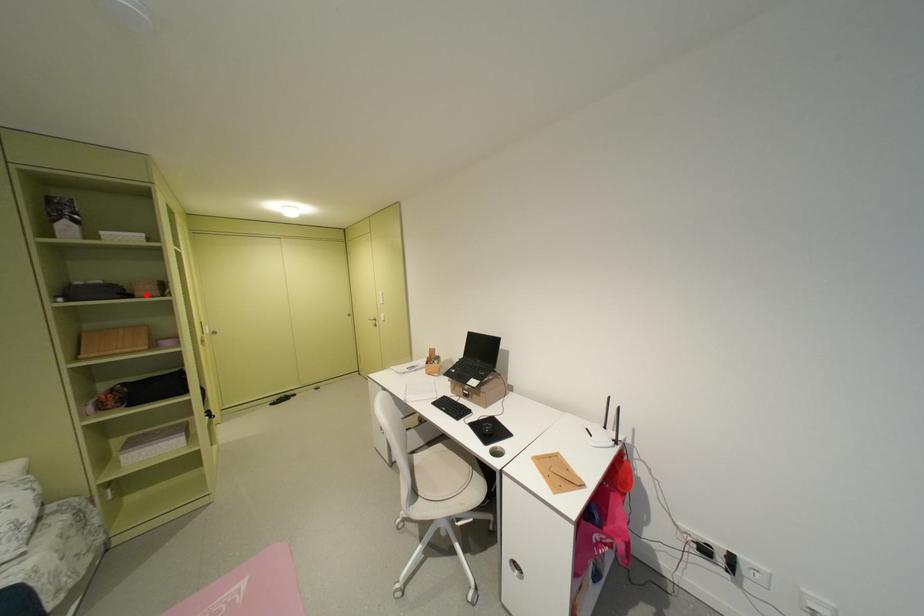
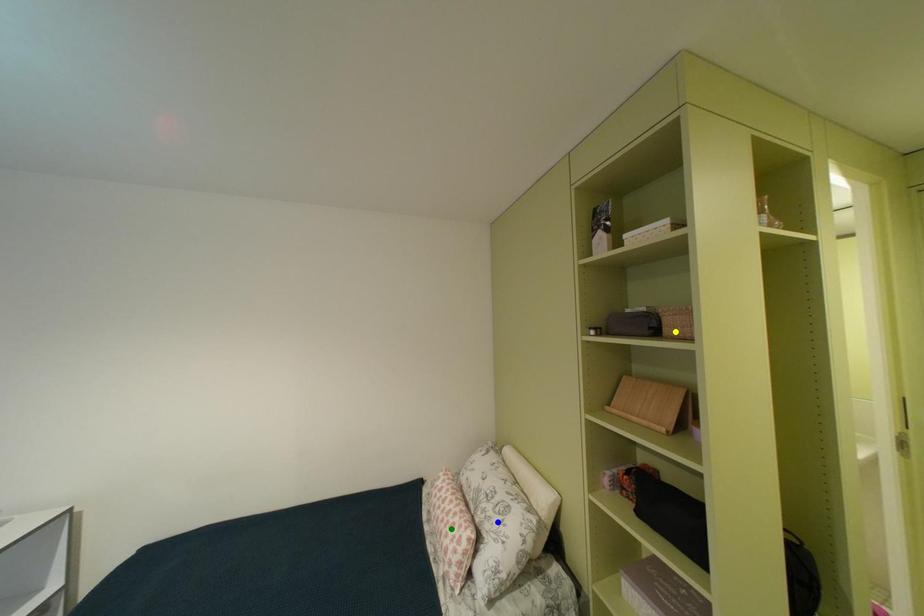
Question: I am providing you with two images of the same scene from different viewpoints. A red point is marked on the first image. You are given multiple points on the second image. Can you choose the point in image 2 that corresponds to the point in image 1?

Choices:
 (A) blue point
 (B) yellow point
 (C) green point

Answer: (B)